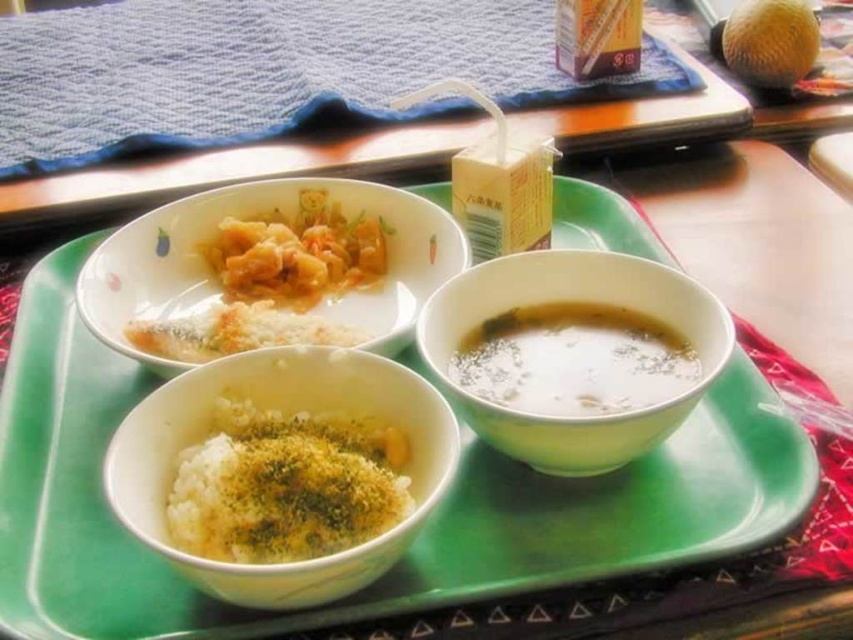
You are setting up a table for a dinner party and have the blue fabric mat at upper left and the white rice with green seasoning at bottom left. Which item is taller when placed on the table?

The blue fabric mat at upper left is taller than the white rice with green seasoning at bottom left according to the description.

You are a food delivery person who needs to place a hot meal on a cart. The cart has limited space, and you must ensure that the white rice with green seasoning at bottom left and the white glossy bowl at upper left are placed in a way that the rice is to the right of the bowl. Can you arrange them correctly?

Yes, according to the description, the white rice with green seasoning at bottom left is already positioned on the right side of the white glossy bowl at upper left, so arranging them in the same relative positions on the cart will satisfy the requirement.

You are a food delivery person who needs to stack the white creamy soup at bottom right and the white crumbly rice at center onto a tray for delivery. Considering their heights, which one should be placed at the bottom to prevent spillage?

The white creamy soup at bottom right is much taller than the white crumbly rice at center, so to prevent spillage, the white creamy soup at bottom right should be placed at the bottom of the stack.